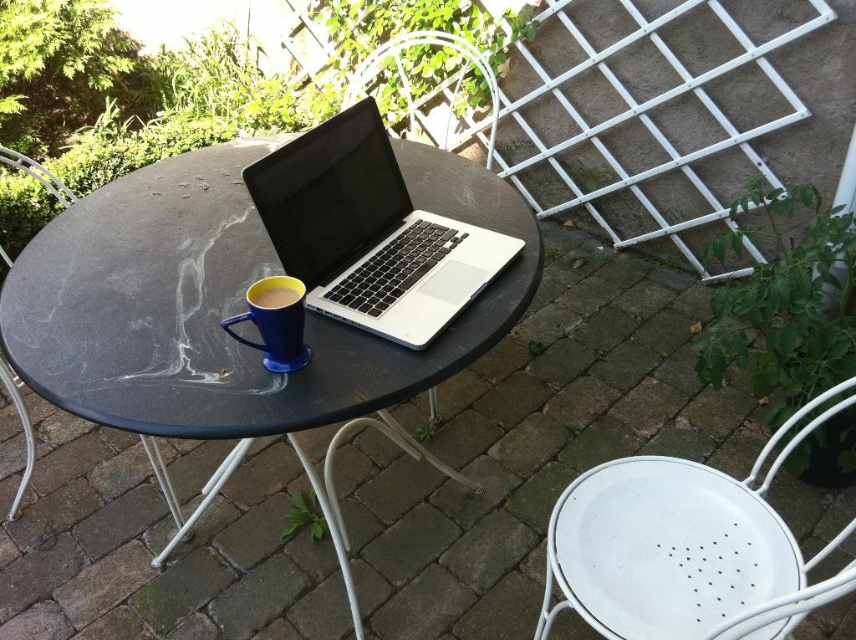
Is matte black table at center to the right of black marble table at center from the viewer's perspective?

Correct, you'll find matte black table at center to the right of black marble table at center.

Is matte black table at center bigger than black marble table at center?

Correct, matte black table at center is larger in size than black marble table at center.

Between point (197, 512) and point (16, 156), which one is positioned behind?

The point (16, 156) is more distant.

Identify the location of matte black table at center. The height and width of the screenshot is (640, 856). (232, 312).

Is silver/black matte laptop at center to the left of matte ceramic mug at center from the viewer's perspective?

In fact, silver/black matte laptop at center is to the right of matte ceramic mug at center.

You are a GUI agent. You are given a task and a screenshot of the screen. Output one action in this format:
    pyautogui.click(x=<x>, y=<y>)
    Task: Click on the silver/black matte laptop at center
    This screenshot has height=640, width=856.
    Given the screenshot: What is the action you would take?
    pyautogui.click(x=369, y=232)

Image resolution: width=856 pixels, height=640 pixels. What are the coordinates of `silver/black matte laptop at center` in the screenshot? It's located at (369, 232).

Describe the element at coordinates (369, 232) in the screenshot. I see `silver/black matte laptop at center` at that location.

Looking at this image, how much distance is there between silver/black matte laptop at center and matte blue mug at center?

silver/black matte laptop at center is 9.09 inches from matte blue mug at center.

Does point (418, 340) come farther from viewer compared to point (288, 330)?

Yes, point (418, 340) is farther from viewer.

Image resolution: width=856 pixels, height=640 pixels. Find the location of `silver/black matte laptop at center`. silver/black matte laptop at center is located at coordinates (369, 232).